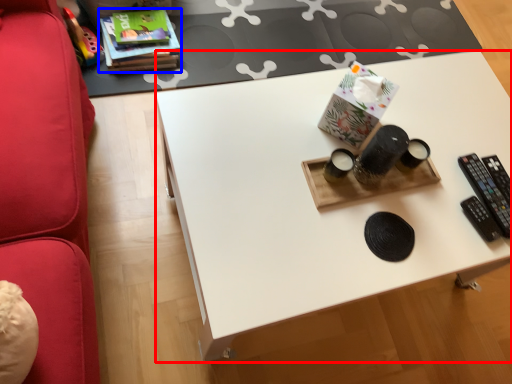
Question: Which point is further to the camera, desk (highlighted by a red box) or book (highlighted by a blue box)?

Choices:
 (A) desk
 (B) book

Answer: (B)